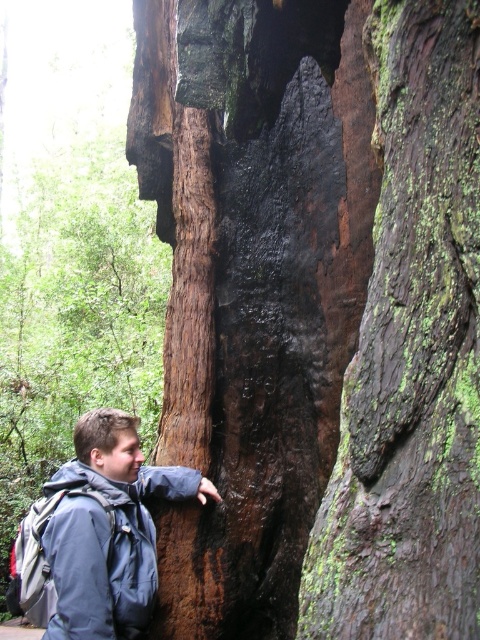
You are a hiker who needs to check the condition of the tree trunk. Which object, the green mossy bark at center or the blue fabric jacket at left, is positioned higher relative to your viewpoint?

Result: The green mossy bark at center is positioned above the blue fabric jacket at left, so it is higher.

Based on the photo, you are a hiker trying to mark your location on a map. The map shows a green mossy bark at center at coordinates point 0.555, 0.856. If you are standing next to the tree trunk, can you confirm if the mossy area is in the lower half of the tree trunk?

The green mossy bark at center is located at point [410,355]. Since the coordinate system typically starts from the bottom left corner, the y coordinate 0.856 indicates it is in the lower half of the tree trunk.

You are a photographer trying to capture a closeup of the point at coordinates (476, 102) in the scene. Given that the point is 38.72 inches from the camera, will you need to adjust your focus to ensure it is sharp?

Yes, the point at coordinates (476, 102) is 38.72 inches from the camera, so you need to adjust your focus to ensure it is sharp.